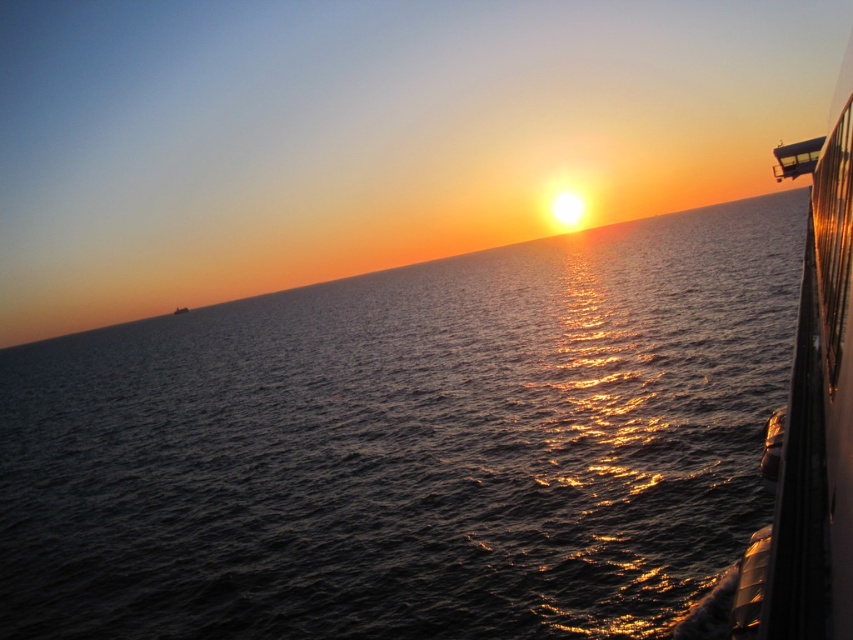
Question: Is dark blue water at center bigger than white glossy boat at right?

Choices:
 (A) yes
 (B) no

Answer: (A)

Question: Among these points, which one is nearest to the camera?

Choices:
 (A) (358, 300)
 (B) (846, 589)

Answer: (B)

Question: Which of the following is the farthest from the observer?

Choices:
 (A) white glossy boat at right
 (B) dark blue water at center

Answer: (B)

Question: Is dark blue water at center bigger than white glossy boat at right?

Choices:
 (A) no
 (B) yes

Answer: (B)

Question: Is dark blue water at center bigger than white glossy boat at right?

Choices:
 (A) no
 (B) yes

Answer: (B)